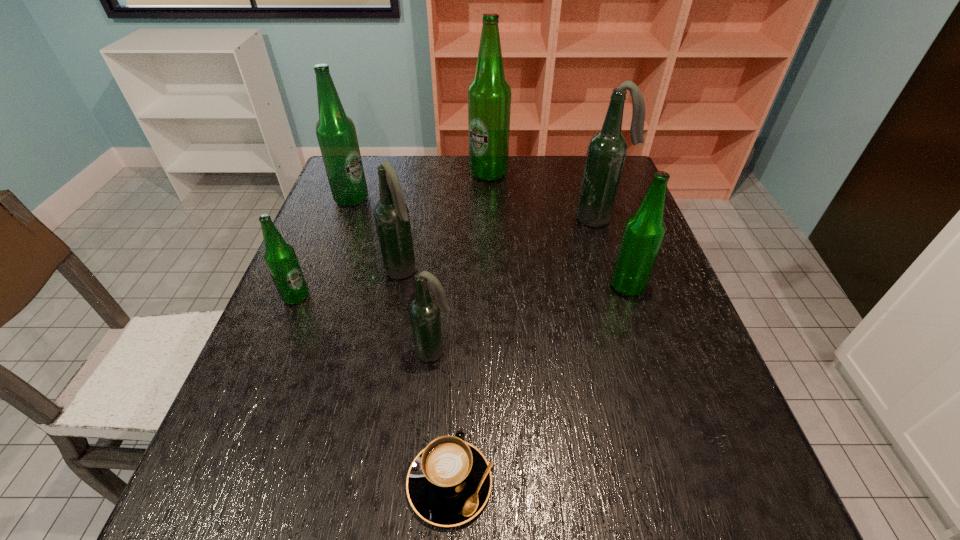
In the image, there is a desktop. Identify the location of vacant space at the near left corner. This screenshot has width=960, height=540. (297, 480).

Where is `blank space at the far right corner`? This screenshot has width=960, height=540. blank space at the far right corner is located at coordinates (582, 158).

Locate an element on the screen. This screenshot has height=540, width=960. vacant area at the near right corner of the desktop is located at coordinates [x=739, y=488].

Locate an element on the screen. This screenshot has width=960, height=540. free space between the third beer bottle from right to left and the cappuccino is located at coordinates (469, 328).

Locate an element on the screen. This screenshot has height=540, width=960. free point between the rightmost green beer bottle and the rightmost dark beer bottle is located at coordinates (613, 252).

Where is `vacant area between the farthest green beer bottle and the rightmost dark beer bottle`? The width and height of the screenshot is (960, 540). vacant area between the farthest green beer bottle and the rightmost dark beer bottle is located at coordinates (544, 196).

You are a GUI agent. You are given a task and a screenshot of the screen. Output one action in this format:
    pyautogui.click(x=<x>, y=<y>)
    Task: Click on the empty location between the black cappuccino and the rightmost dark beer bottle
    The width and height of the screenshot is (960, 540).
    Given the screenshot: What is the action you would take?
    pyautogui.click(x=525, y=350)

Where is `empty space between the smallest green beer bottle and the cappuccino`? This screenshot has height=540, width=960. empty space between the smallest green beer bottle and the cappuccino is located at coordinates (373, 390).

You are a GUI agent. You are given a task and a screenshot of the screen. Output one action in this format:
    pyautogui.click(x=<x>, y=<y>)
    Task: Click on the empty location between the third biggest green beer bottle and the farthest object
    The height and width of the screenshot is (540, 960).
    Given the screenshot: What is the action you would take?
    pyautogui.click(x=558, y=230)

At what (x,y) coordinates should I click in order to perform the action: click on free space between the farthest dark beer bottle and the biggest green beer bottle. Please return your answer as a coordinate pair (x, y). The height and width of the screenshot is (540, 960). Looking at the image, I should click on (544, 196).